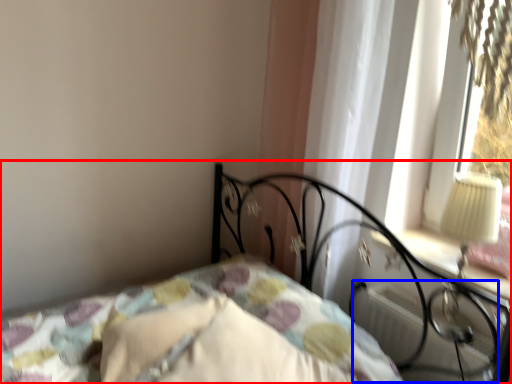
Question: Which object appears farthest to the camera in this image, bed (highlighted by a red box) or radiator (highlighted by a blue box)?

Choices:
 (A) bed
 (B) radiator

Answer: (B)